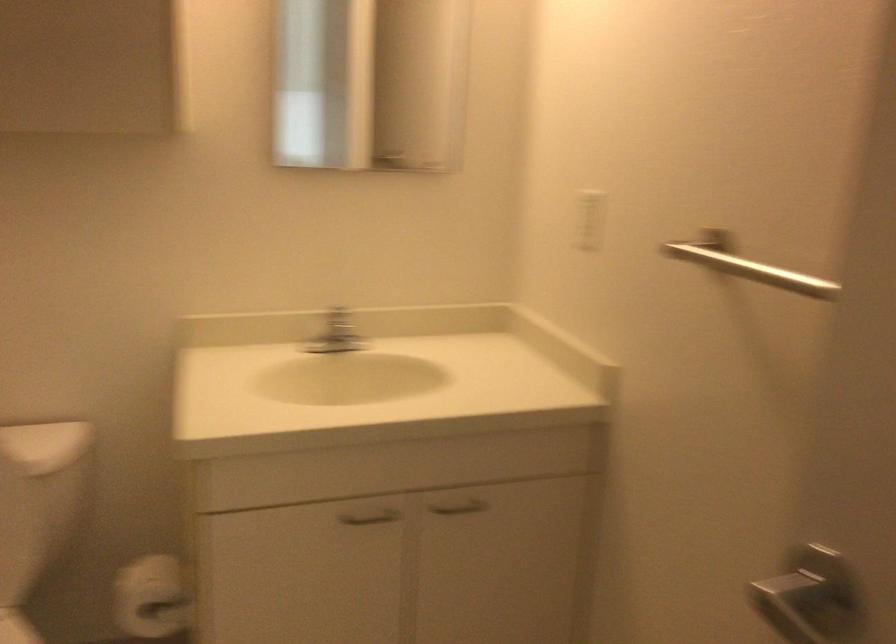
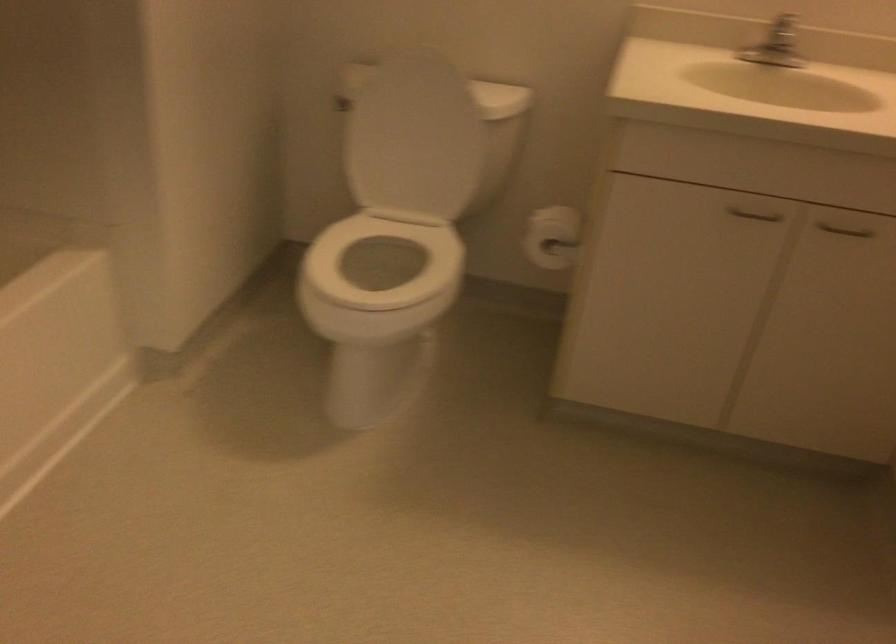
Find the pixel in the second image that matches (464,514) in the first image.

(845, 230)